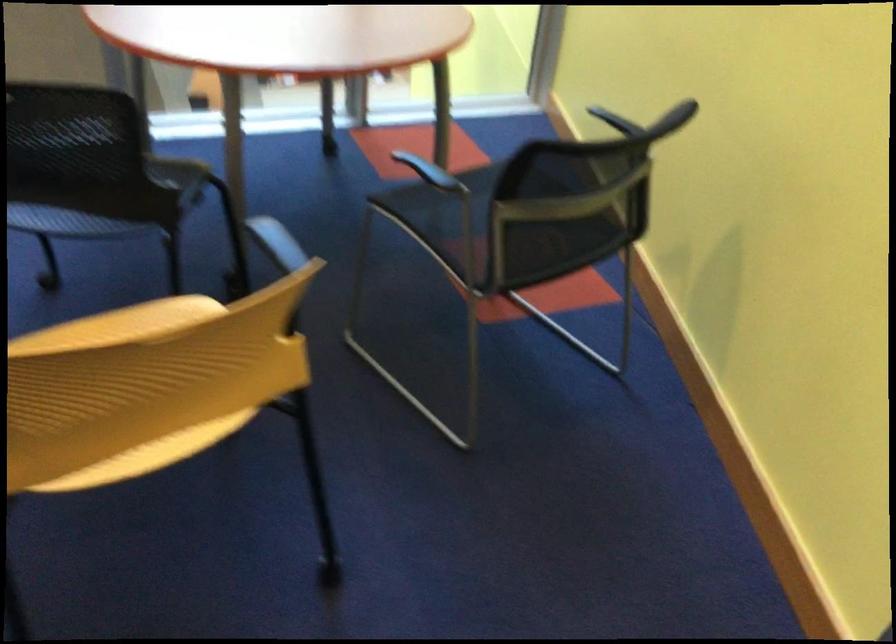
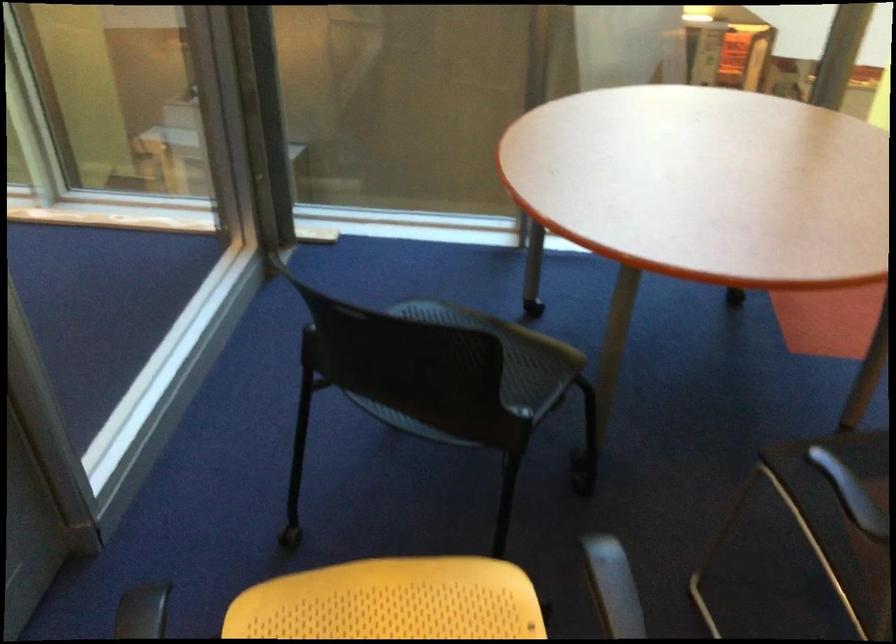
The images are taken continuously from a first-person perspective. In which direction are you moving?

The cameraman walked toward left, forward.